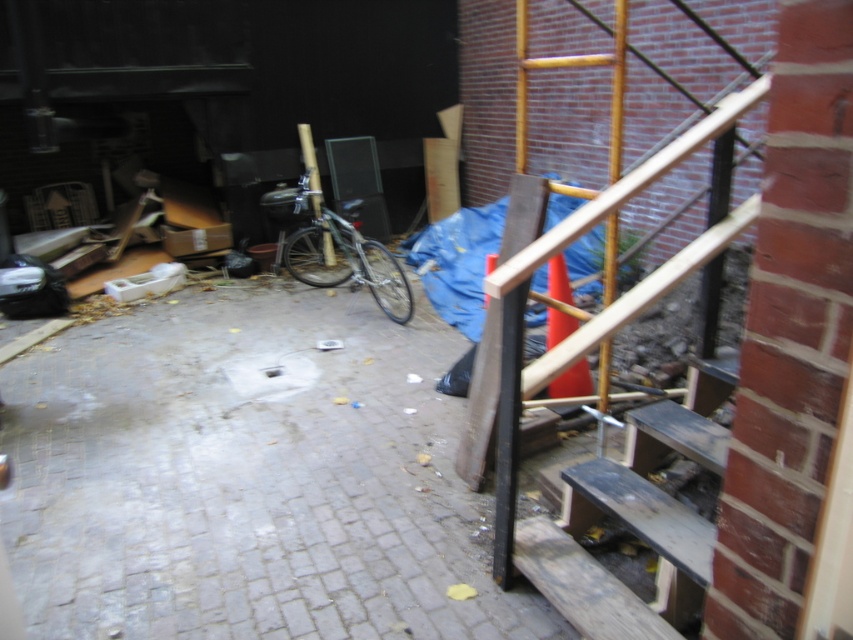
Between point (572, 529) and point (660, 541), which one is positioned behind?

The point (572, 529) is more distant.

Between wooden at right and dark brown wooden stairs at lower right, which one appears on the left side from the viewer's perspective?

wooden at right is more to the left.

Is point (555, 547) behind point (689, 372)?

That is False.

The image size is (853, 640). Identify the location of wooden at right. (595, 220).

Is wooden at right above shiny metallic bicycle at center?

No.

Who is lower down, wooden at right or shiny metallic bicycle at center?

wooden at right is lower down.

Locate an element on the screen. wooden at right is located at coordinates (595, 220).

In order to click on wooden at right in this screenshot , I will do `click(595, 220)`.

Which of these two, dark brown wooden stairs at lower right or shiny metallic bicycle at center, stands taller?

Standing taller between the two is shiny metallic bicycle at center.

In the scene shown: Can you confirm if dark brown wooden stairs at lower right is taller than shiny metallic bicycle at center?

In fact, dark brown wooden stairs at lower right may be shorter than shiny metallic bicycle at center.

Locate an element on the screen. dark brown wooden stairs at lower right is located at coordinates (635, 518).